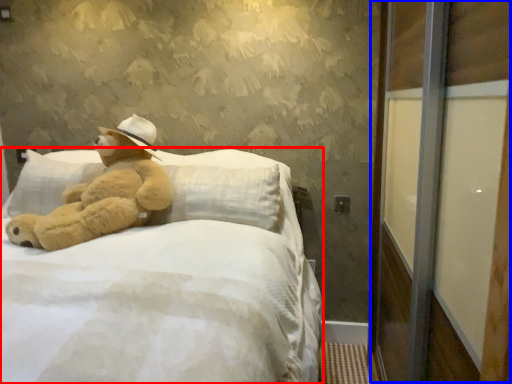
Question: Which point is closer to the camera, bed (highlighted by a red box) or screen door (highlighted by a blue box)?

Choices:
 (A) bed
 (B) screen door

Answer: (B)